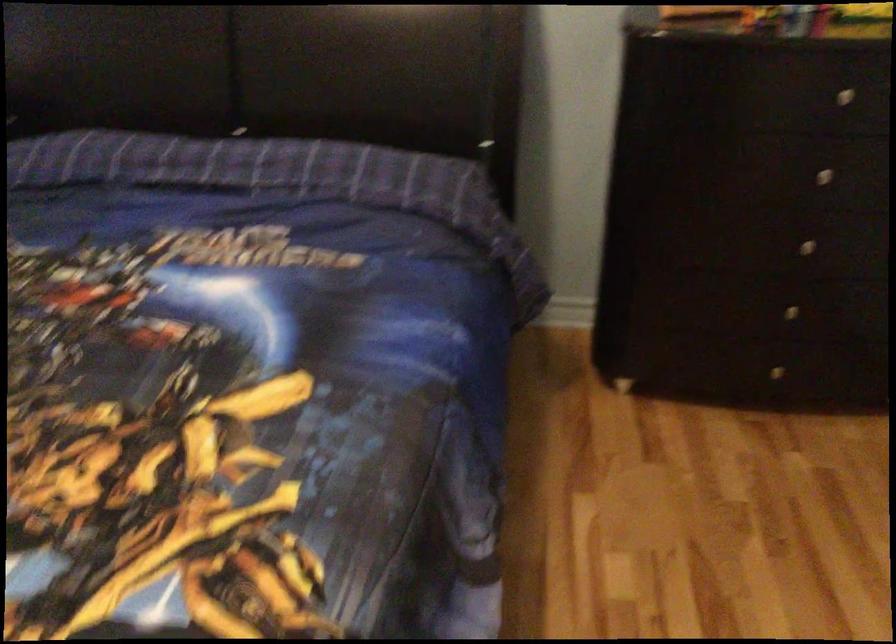
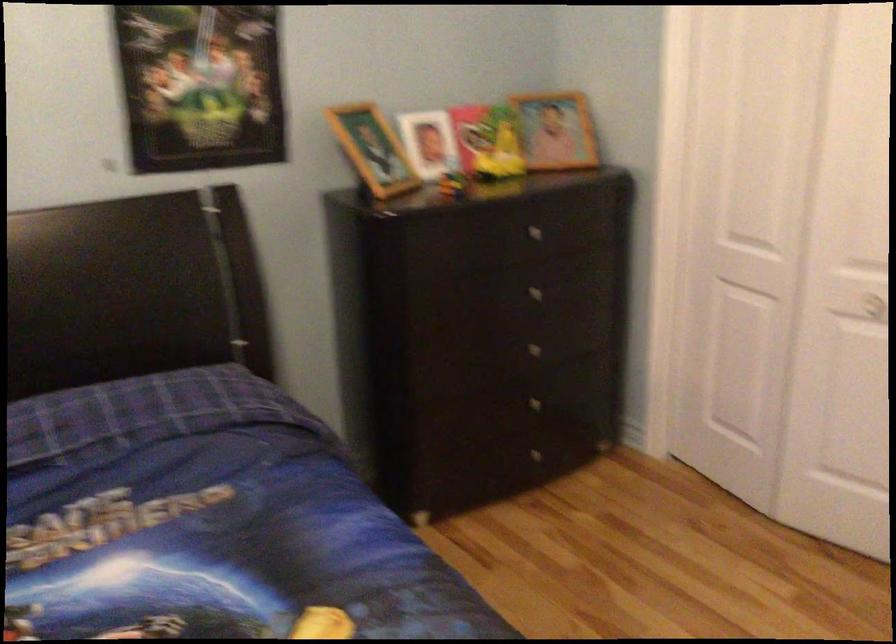
The point at (768,308) is marked in the first image. Where is the corresponding point in the second image?

(528, 406)